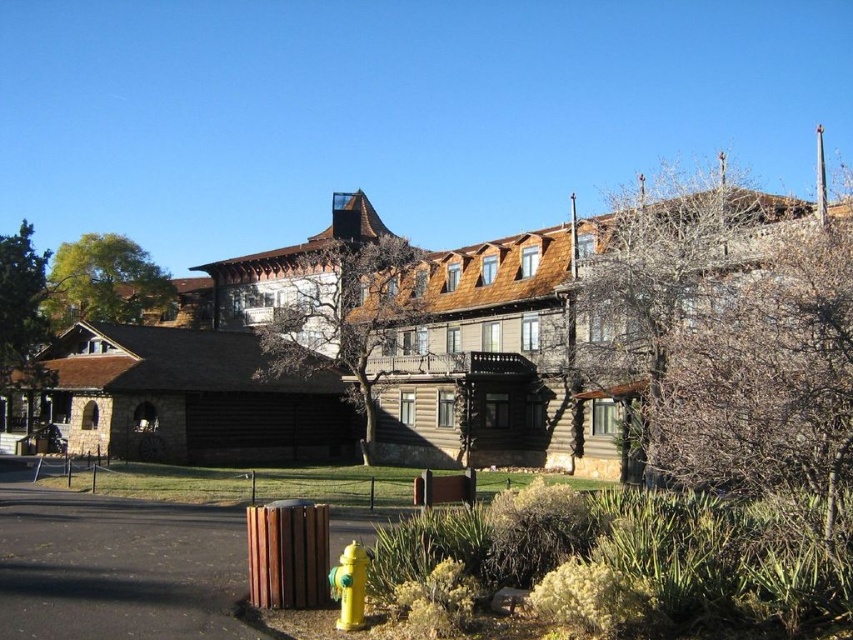
Question: Does brown wooden tree at upper center appear on the right side of green leafy tree at upper left?

Choices:
 (A) no
 (B) yes

Answer: (B)

Question: Which object is farther from the camera taking this photo?

Choices:
 (A) brown wooden tree at upper center
 (B) yellow matte fire hydrant at lower center
 (C) green leafy tree at upper left
 (D) brown textured tree at upper right

Answer: (C)

Question: Can you confirm if brown textured tree at upper right is positioned to the left of yellow matte fire hydrant at lower center?

Choices:
 (A) yes
 (B) no

Answer: (B)

Question: Estimate the real-world distances between objects in this image. Which object is closer to the green leafy tree at upper left?

Choices:
 (A) yellow matte fire hydrant at lower center
 (B) brown wooden tree at upper center
 (C) brown textured tree at upper right

Answer: (B)

Question: Which point is closer to the camera?

Choices:
 (A) (753, 269)
 (B) (120, 243)

Answer: (A)

Question: Is brown textured tree at upper right positioned in front of yellow matte fire hydrant at lower center?

Choices:
 (A) yes
 (B) no

Answer: (A)